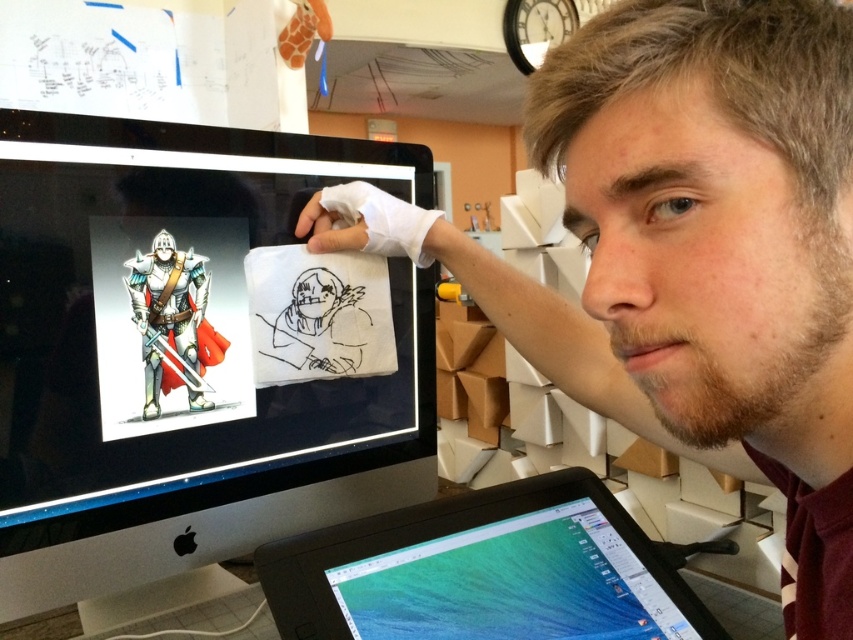
Which is more to the right, black glossy monitor at upper left or black plastic tablet at lower center?

Positioned to the right is black plastic tablet at lower center.

Is point (19, 419) farther from viewer compared to point (373, 588)?

That is True.

Who is more forward, (194, 209) or (640, 588)?

Point (640, 588) is in front.

Identify the location of black glossy monitor at upper left. Image resolution: width=853 pixels, height=640 pixels. (178, 355).